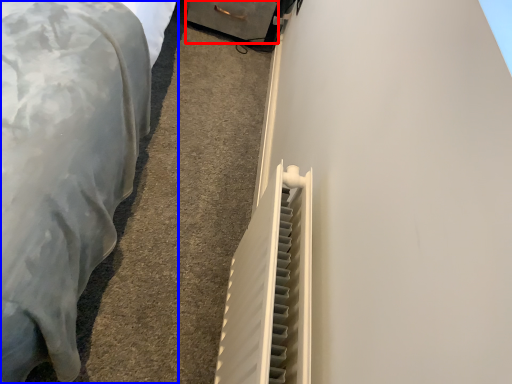
Question: Which of the following is the farthest to the observer, drawer (highlighted by a red box) or furniture (highlighted by a blue box)?

Choices:
 (A) drawer
 (B) furniture

Answer: (A)